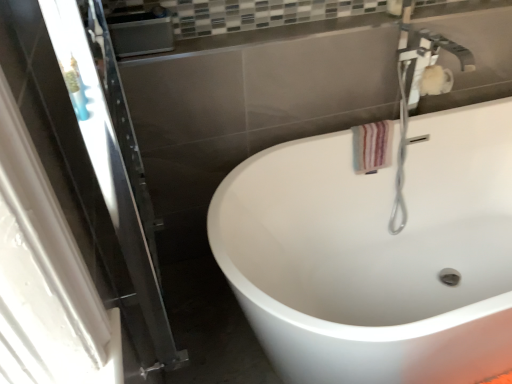
Where is `white glossy bathtub at center`? The height and width of the screenshot is (384, 512). white glossy bathtub at center is located at coordinates (376, 254).

Identify the location of white glossy faucet at upper right. This screenshot has height=384, width=512. (402, 141).

Locate an element on the screen. striped fabric hand towel at upper right is located at coordinates (372, 146).

Which is more to the left, transparent glass screen door at left or striped fabric hand towel at upper right?

Positioned to the left is transparent glass screen door at left.

Does point (50, 5) come farther from viewer compared to point (365, 171)?

No.

Considering the sizes of objects transparent glass screen door at left and striped fabric hand towel at upper right in the image provided, who is bigger, transparent glass screen door at left or striped fabric hand towel at upper right?

Bigger between the two is transparent glass screen door at left.

From a real-world perspective, does transparent glass screen door at left stand above white glossy faucet at upper right?

Yes, from a real-world perspective, transparent glass screen door at left is over white glossy faucet at upper right

In the image, is transparent glass screen door at left positioned in front of or behind white glossy faucet at upper right?

In the image, transparent glass screen door at left appears in front of white glossy faucet at upper right.

Is transparent glass screen door at left situated inside white glossy faucet at upper right or outside?

transparent glass screen door at left lies outside white glossy faucet at upper right.

Find the location of a particular element. The image size is (512, 384). plumbing fixture behind the transparent glass screen door at left is located at coordinates (402, 141).

Is white glossy faucet at upper right oriented towards striped fabric hand towel at upper right?

No, white glossy faucet at upper right is not turned towards striped fabric hand towel at upper right.

Is white glossy faucet at upper right next to striped fabric hand towel at upper right and touching it?

white glossy faucet at upper right and striped fabric hand towel at upper right are clearly separated.

How distant is white glossy faucet at upper right from striped fabric hand towel at upper right?

white glossy faucet at upper right and striped fabric hand towel at upper right are 6.49 inches apart from each other.

Would you say striped fabric hand towel at upper right is part of white glossy faucet at upper right's contents?

Actually, striped fabric hand towel at upper right is outside white glossy faucet at upper right.

In the scene shown: From a real-world perspective, between striped fabric hand towel at upper right and white glossy faucet at upper right, who is vertically lower?

striped fabric hand towel at upper right.

Consider the image. Between striped fabric hand towel at upper right and white glossy faucet at upper right, which one has smaller size?

With smaller size is striped fabric hand towel at upper right.

Considering the sizes of objects striped fabric hand towel at upper right and white glossy faucet at upper right in the image provided, who is taller, striped fabric hand towel at upper right or white glossy faucet at upper right?

Standing taller between the two is white glossy faucet at upper right.

Can you confirm if striped fabric hand towel at upper right is wider than white glossy faucet at upper right?

In fact, striped fabric hand towel at upper right might be narrower than white glossy faucet at upper right.

Consider the image. Which is in front, striped fabric hand towel at upper right or transparent glass screen door at left?

Positioned in front is transparent glass screen door at left.

Considering the sizes of objects striped fabric hand towel at upper right and transparent glass screen door at left in the image provided, who is bigger, striped fabric hand towel at upper right or transparent glass screen door at left?

Bigger between the two is transparent glass screen door at left.

Is striped fabric hand towel at upper right turned away from transparent glass screen door at left?

That's not correct — striped fabric hand towel at upper right is not looking away from transparent glass screen door at left.

Is striped fabric hand towel at upper right situated inside transparent glass screen door at left or outside?

striped fabric hand towel at upper right is not enclosed by transparent glass screen door at left.

Locate an element on the screen. This screenshot has height=384, width=512. screen door in front of the white glossy bathtub at center is located at coordinates (91, 161).

Who is shorter, transparent glass screen door at left or white glossy bathtub at center?

white glossy bathtub at center is shorter.

Does transparent glass screen door at left have a lesser width compared to white glossy bathtub at center?

Indeed, transparent glass screen door at left has a lesser width compared to white glossy bathtub at center.

Can you confirm if white glossy bathtub at center is shorter than striped fabric hand towel at upper right?

No.

Looking at the image, does white glossy bathtub at center seem bigger or smaller compared to striped fabric hand towel at upper right?

Considering their sizes, white glossy bathtub at center takes up more space than striped fabric hand towel at upper right.

Is white glossy bathtub at center aimed at striped fabric hand towel at upper right?

No.

Locate an element on the screen. The image size is (512, 384). bathtub directly beneath the striped fabric hand towel at upper right (from a real-world perspective) is located at coordinates (376, 254).

Where is `screen door below the striped fabric hand towel at upper right (from the image's perspective)`? Image resolution: width=512 pixels, height=384 pixels. screen door below the striped fabric hand towel at upper right (from the image's perspective) is located at coordinates tap(91, 161).

Identify the location of plumbing fixture on the right of transparent glass screen door at left. The width and height of the screenshot is (512, 384). (402, 141).

Which object lies nearer to the anchor point white glossy bathtub at center, transparent glass screen door at left or white glossy faucet at upper right?

Among the two, white glossy faucet at upper right is located nearer to white glossy bathtub at center.

Considering their positions, is white glossy faucet at upper right positioned closer to transparent glass screen door at left than white glossy bathtub at center?

The object closer to transparent glass screen door at left is white glossy bathtub at center.

Consider the image. Based on their spatial positions, is transparent glass screen door at left or white glossy faucet at upper right further from striped fabric hand towel at upper right?

transparent glass screen door at left lies further to striped fabric hand towel at upper right than the other object.

Which object lies further to the anchor point white glossy faucet at upper right, striped fabric hand towel at upper right or white glossy bathtub at center?

The object further to white glossy faucet at upper right is white glossy bathtub at center.

From the image, which object appears to be nearer to striped fabric hand towel at upper right, transparent glass screen door at left or white glossy bathtub at center?

white glossy bathtub at center is positioned closer to the anchor striped fabric hand towel at upper right.

From the image, which object appears to be farther from white glossy bathtub at center, striped fabric hand towel at upper right or transparent glass screen door at left?

The object further to white glossy bathtub at center is transparent glass screen door at left.

When comparing their distances from white glossy faucet at upper right, does white glossy bathtub at center or striped fabric hand towel at upper right seem further?

white glossy bathtub at center is further to white glossy faucet at upper right.

Which object lies further to the anchor point white glossy bathtub at center, striped fabric hand towel at upper right or white glossy faucet at upper right?

Among the two, striped fabric hand towel at upper right is located further to white glossy bathtub at center.

I want to click on plumbing fixture between transparent glass screen door at left and striped fabric hand towel at upper right from front to back, so (402, 141).

Identify the location of bathtub between transparent glass screen door at left and striped fabric hand towel at upper right in the front-back direction. tap(376, 254).

This screenshot has height=384, width=512. I want to click on plumbing fixture between transparent glass screen door at left and white glossy bathtub at center in the horizontal direction, so click(x=402, y=141).

You are a GUI agent. You are given a task and a screenshot of the screen. Output one action in this format:
    pyautogui.click(x=<x>, y=<y>)
    Task: Click on the plumbing fixture between white glossy bathtub at center and striped fabric hand towel at upper right along the z-axis
    The image size is (512, 384).
    Given the screenshot: What is the action you would take?
    pyautogui.click(x=402, y=141)